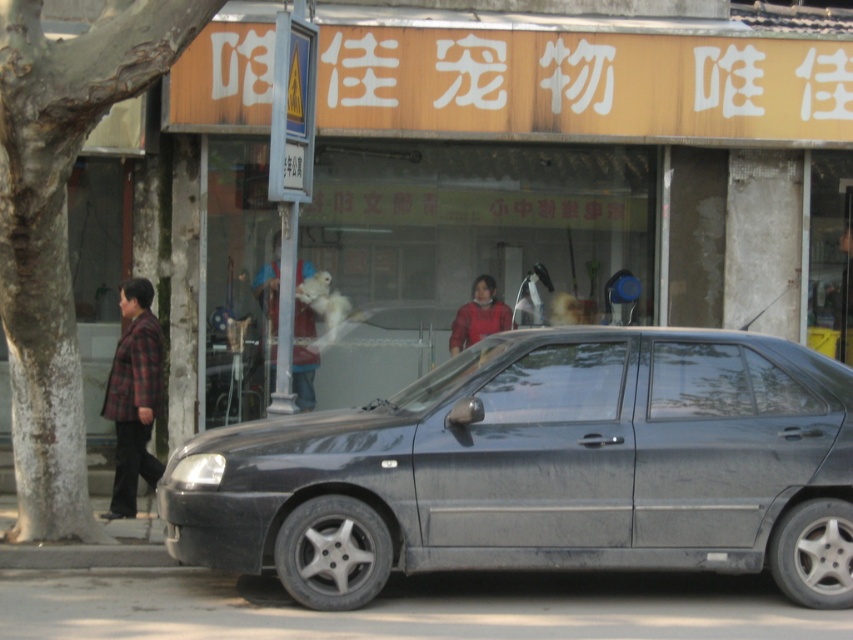
You are standing on the street and see the parked dark colored sedan in the foreground and the plaid fabric jacket at left. Which object is closer to you?

The plaid fabric jacket at left is closer to you because it is located at point (132, 396), which is in the foreground relative to the parked dark colored sedan in the foreground.